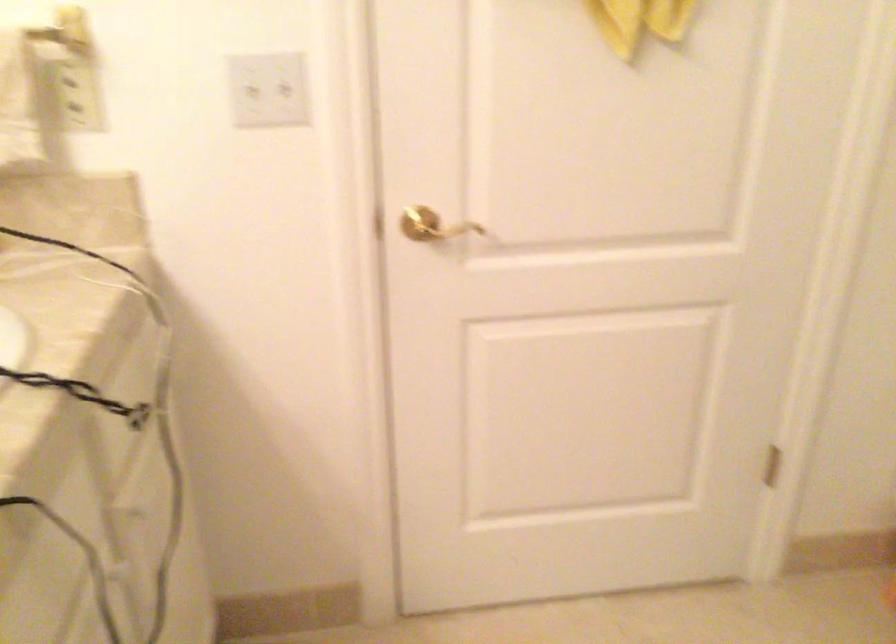
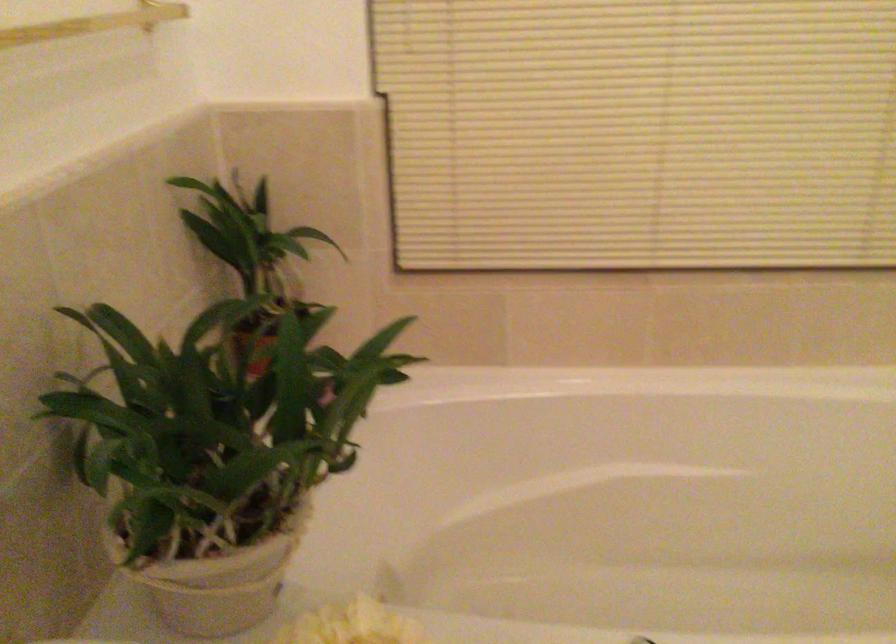
Question: The images are taken continuously from a first-person perspective. In which direction is your viewpoint rotating?

Choices:
 (A) Left
 (B) Right
 (C) Up
 (D) Down

Answer: (B)